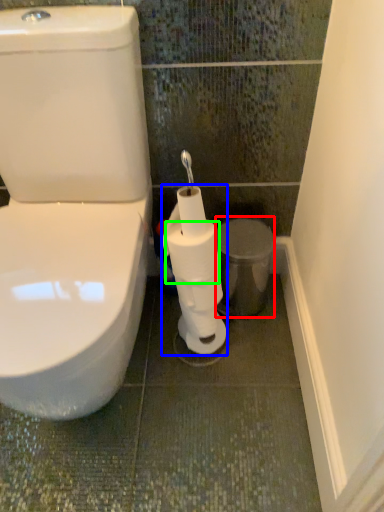
Question: Which is farther away from porcelain (highlighted by a red box)? toilet paper (highlighted by a blue box) or toilet paper (highlighted by a green box)?

Choices:
 (A) toilet paper
 (B) toilet paper

Answer: (A)